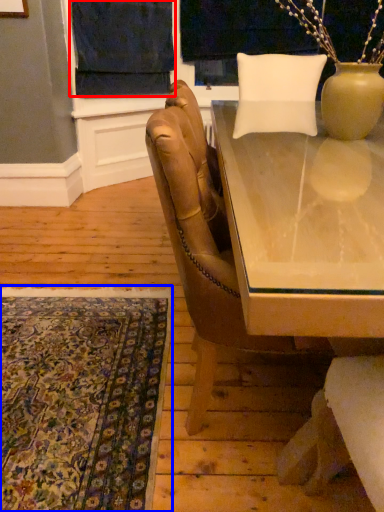
Question: Which of the following is the closest to the observer, curtain (highlighted by a red box) or mat (highlighted by a blue box)?

Choices:
 (A) curtain
 (B) mat

Answer: (B)